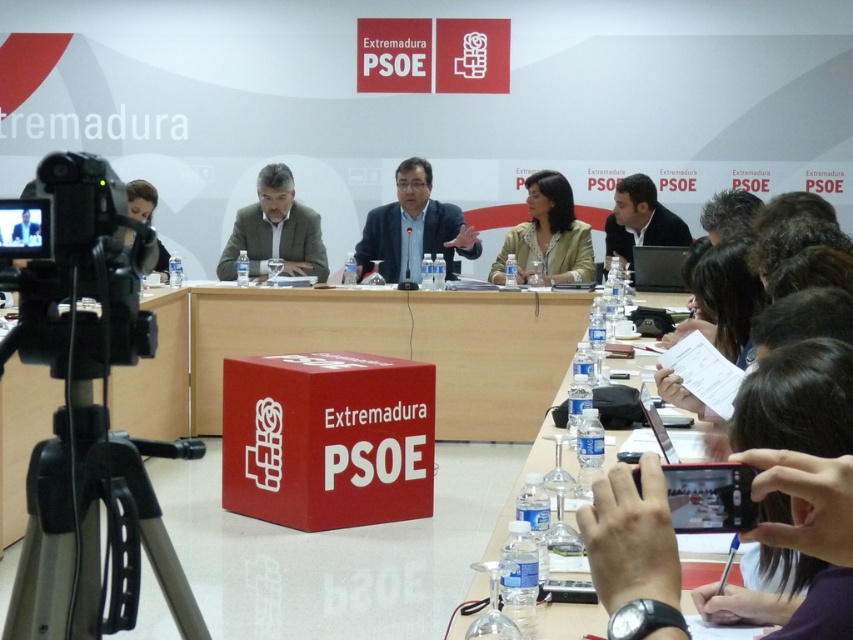
You are attending a press conference in Extremadura and want to place a small item on the table. The table is represented by the point at coordinates (402, 346). If the table is rectangular and centered in the room, where should you aim to place your item to ensure it is on the table?

The point at coordinates (402, 346) indicates the red plastic table at center, so placing the item near this point would ensure it is on the table.